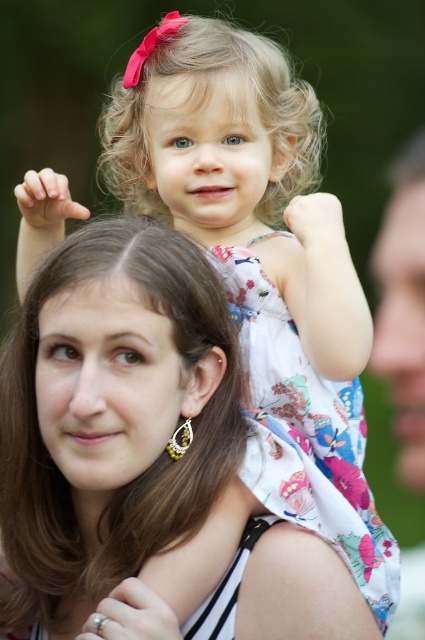
You are a photographer trying to capture a closeup shot of the brown smooth hair at center and the smooth skin arm at upper center. The camera you are using has a minimum focusing distance of 12 inches. Will you be able to take the photo without moving the camera closer?

The distance between the brown smooth hair at center and the smooth skin arm at upper center is 13.60 inches, which is greater than the camera minimum focusing distance of 12 inches. Therefore, you can take the photo without moving the camera closer.

You are standing at the point marked as point (88, 316) in the image. You want to hand a small gift to the woman in the black and white striped top. Can you reach her from your current position without moving? Please explain your reasoning.

The distance between you and the woman is 1.36 meters. Since the average arm length is about 0.7 meters, you cannot reach her without moving closer.